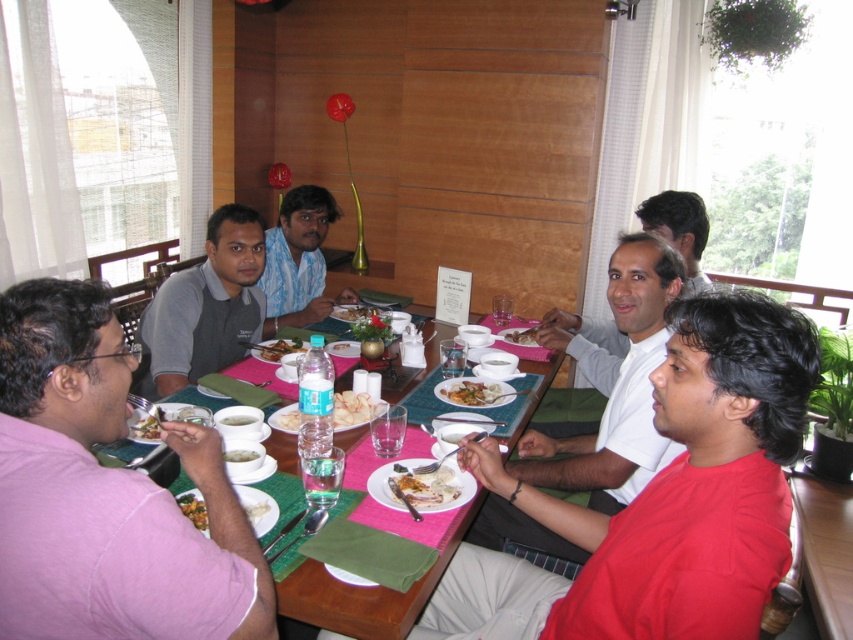
Is red matte shirt at lower right positioned before white matte shirt at center?

Yes, red matte shirt at lower right is in front of white matte shirt at center.

Which is above, red matte shirt at lower right or white matte shirt at center?

white matte shirt at center

Does point (570, 608) come closer to viewer compared to point (613, 460)?

Yes, point (570, 608) is closer to viewer.

Locate an element on the screen. This screenshot has width=853, height=640. red matte shirt at lower right is located at coordinates (662, 500).

Does white matte shirt at center appear on the right side of blue textured shirt at center?

Indeed, white matte shirt at center is positioned on the right side of blue textured shirt at center.

Does white matte shirt at center have a larger size compared to blue textured shirt at center?

Indeed, white matte shirt at center has a larger size compared to blue textured shirt at center.

Which is in front, point (631, 273) or point (303, 288)?

Point (631, 273) is in front.

At what (x,y) coordinates should I click in order to perform the action: click on white matte shirt at center. Please return your answer as a coordinate pair (x, y). Looking at the image, I should click on (618, 388).

Looking at this image, is white matte shirt at center further to the viewer compared to golden fried snacks at center?

Yes, white matte shirt at center is further from the viewer.

Who is positioned more to the right, white matte shirt at center or golden fried snacks at center?

Positioned to the right is white matte shirt at center.

At what (x,y) coordinates should I click in order to perform the action: click on white matte shirt at center. Please return your answer as a coordinate pair (x, y). Image resolution: width=853 pixels, height=640 pixels. Looking at the image, I should click on (618, 388).